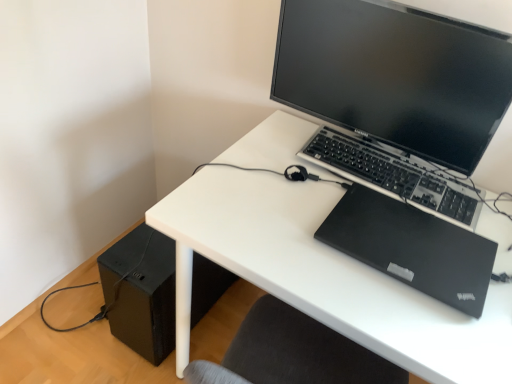
Where is `vacant space positioned to the left of black plastic keyboard at center`? Image resolution: width=512 pixels, height=384 pixels. vacant space positioned to the left of black plastic keyboard at center is located at coordinates pos(276,179).